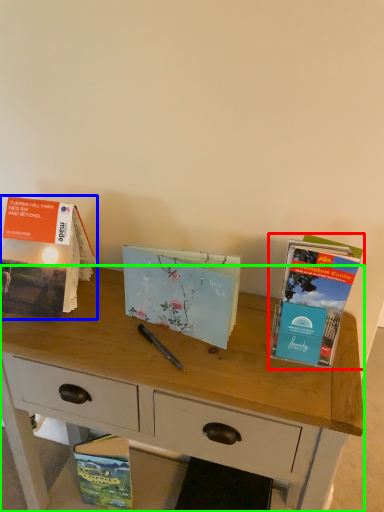
Question: Which is nearer to the book (highlighted by a red box)? book (highlighted by a blue box) or desk (highlighted by a green box).

Choices:
 (A) book
 (B) desk

Answer: (B)